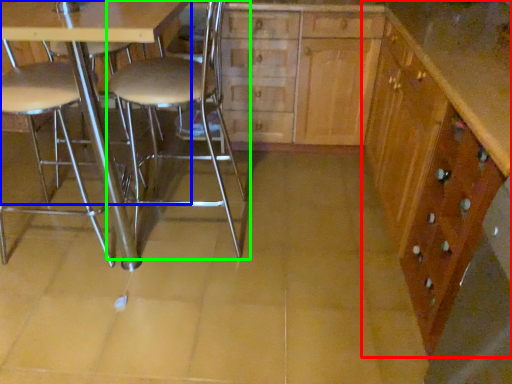
Question: Which is nearer to the cabinetry (highlighted by a red box)? table (highlighted by a blue box) or chair (highlighted by a green box).

Choices:
 (A) table
 (B) chair

Answer: (B)